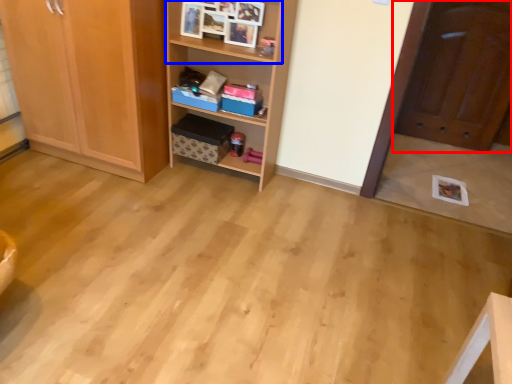
Question: Which object is closer to the camera taking this photo, door (highlighted by a red box) or cabinet (highlighted by a blue box)?

Choices:
 (A) door
 (B) cabinet

Answer: (B)